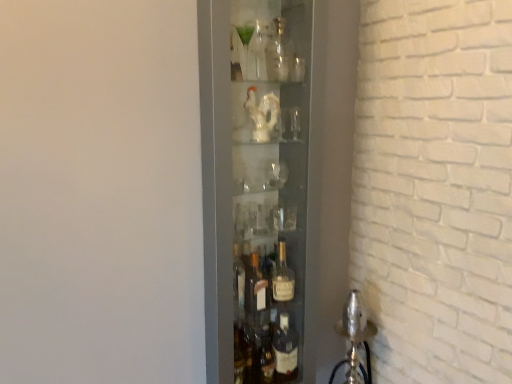
Question: Is clear glass bottle at center, which is the second bottle from bottom to top, next to transparent glass bottles at center?

Choices:
 (A) no
 (B) yes

Answer: (A)

Question: Is clear glass bottle at center, which is counted as the third bottle, starting from the back, shorter than transparent glass bottles at center?

Choices:
 (A) yes
 (B) no

Answer: (A)

Question: Can you confirm if clear glass bottle at center, which is the first bottle from front to back, is thinner than transparent glass bottles at center?

Choices:
 (A) yes
 (B) no

Answer: (A)

Question: Is clear glass bottle at center, which is counted as the third bottle, starting from the back, facing away from transparent glass bottles at center?

Choices:
 (A) no
 (B) yes

Answer: (B)

Question: Does clear glass bottle at center, the second bottle in the top-to-bottom sequence, have a greater width compared to transparent glass bottles at center?

Choices:
 (A) no
 (B) yes

Answer: (A)

Question: Is clear glass bottle at center, the second bottle in the top-to-bottom sequence, to the left of transparent glass bottles at center from the viewer's perspective?

Choices:
 (A) yes
 (B) no

Answer: (B)

Question: Considering the relative sizes of translucent glass bottle at center, which is the 1th bottle from bottom to top, and transparent glass bottles at center in the image provided, is translucent glass bottle at center, which is the 1th bottle from bottom to top, shorter than transparent glass bottles at center?

Choices:
 (A) yes
 (B) no

Answer: (A)

Question: Can you confirm if translucent glass bottle at center, acting as the first bottle starting from the back, is thinner than transparent glass bottles at center?

Choices:
 (A) yes
 (B) no

Answer: (A)

Question: Is the surface of translucent glass bottle at center, which is the 3th bottle in front-to-back order, in direct contact with transparent glass bottles at center?

Choices:
 (A) yes
 (B) no

Answer: (B)

Question: Considering the relative sizes of translucent glass bottle at center, the 3th bottle positioned from the top, and transparent glass bottles at center in the image provided, is translucent glass bottle at center, the 3th bottle positioned from the top, smaller than transparent glass bottles at center?

Choices:
 (A) yes
 (B) no

Answer: (A)

Question: Does translucent glass bottle at center, which is the 1th bottle from bottom to top, appear on the right side of transparent glass bottles at center?

Choices:
 (A) yes
 (B) no

Answer: (A)

Question: From the image's perspective, is translucent glass bottle at center, which is the 1th bottle from bottom to top, beneath transparent glass bottles at center?

Choices:
 (A) yes
 (B) no

Answer: (A)

Question: From a real-world perspective, is clear glass bottle at upper center, acting as the 2th bottle starting from the back, physically below translucent glass bottle at center, acting as the first bottle starting from the back?

Choices:
 (A) no
 (B) yes

Answer: (A)